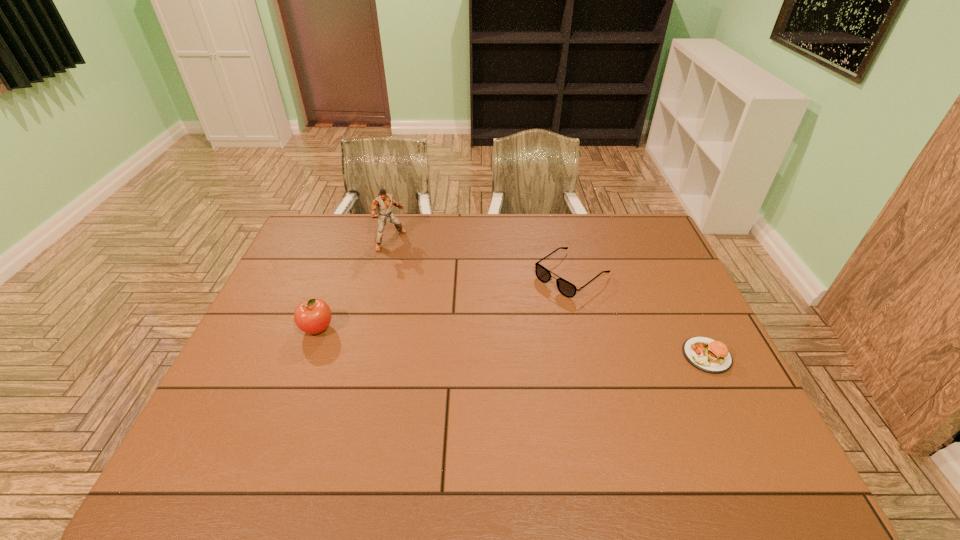
Locate an element on the screen. The width and height of the screenshot is (960, 540). vacant area situated 0.230m on the front-facing side of the second object from right to left is located at coordinates (495, 330).

Identify the location of free spot located on the front-facing side of the second object from right to left. (459, 357).

You are a GUI agent. You are given a task and a screenshot of the screen. Output one action in this format:
    pyautogui.click(x=<x>, y=<y>)
    Task: Click on the blank space located on the front-facing side of the second object from right to left
    
    Given the screenshot: What is the action you would take?
    pyautogui.click(x=465, y=353)

You are a GUI agent. You are given a task and a screenshot of the screen. Output one action in this format:
    pyautogui.click(x=<x>, y=<y>)
    Task: Click on the vacant space located on the front-facing side of the third object from right to left
    This screenshot has width=960, height=540.
    Given the screenshot: What is the action you would take?
    pyautogui.click(x=424, y=267)

Find the location of `vacant space situated 0.260m on the front-facing side of the third object from right to left`. vacant space situated 0.260m on the front-facing side of the third object from right to left is located at coordinates (448, 285).

Locate an element on the screen. Image resolution: width=960 pixels, height=540 pixels. blank space located 0.260m on the front-facing side of the third object from right to left is located at coordinates (448, 285).

Find the location of a particular element. Image resolution: width=960 pixels, height=540 pixels. spectacles that is at the far edge is located at coordinates (566, 288).

You are a GUI agent. You are given a task and a screenshot of the screen. Output one action in this format:
    pyautogui.click(x=<x>, y=<y>)
    Task: Click on the puncher that is at the far edge
    
    Given the screenshot: What is the action you would take?
    pyautogui.click(x=383, y=202)

You are a GUI agent. You are given a task and a screenshot of the screen. Output one action in this format:
    pyautogui.click(x=<x>, y=<y>)
    Task: Click on the object that is at the left edge
    
    Given the screenshot: What is the action you would take?
    pyautogui.click(x=313, y=316)

I want to click on object present at the right edge, so click(711, 356).